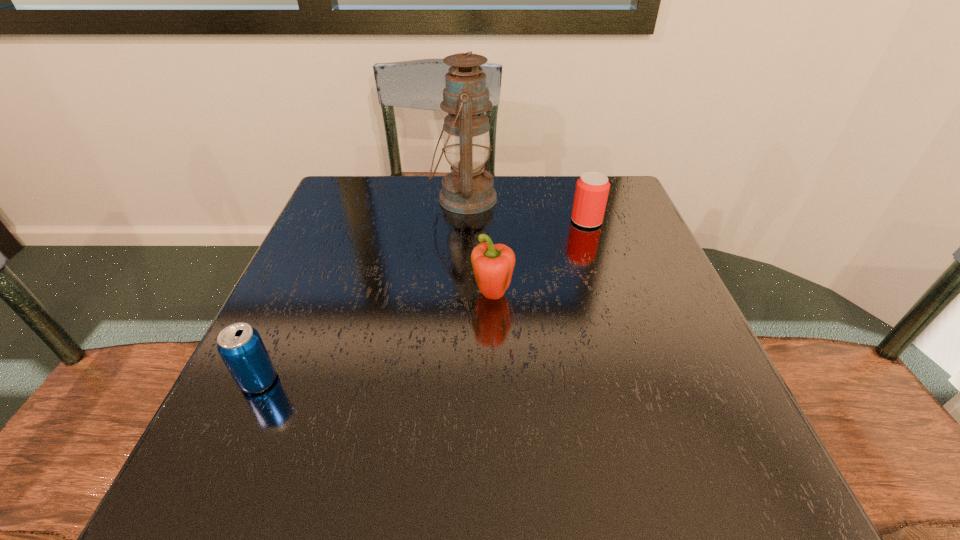
Locate an element on the screen. This screenshot has width=960, height=540. object that is the third nearest to the third farthest object is located at coordinates (240, 346).

Choose which object is the second nearest neighbor to the beer can. Please provide its 2D coordinates. Your answer should be formatted as a tuple, i.e. [(x, y)], where the tuple contains the x and y coordinates of a point satisfying the conditions above.

[(493, 265)]

The height and width of the screenshot is (540, 960). Identify the location of free location that satisfies the following two spatial constraints: 1. on the back side of the pop soda; 2. on the left side of the third farthest object. (297, 296).

Where is `vacant space that satisfies the following two spatial constraints: 1. on the back side of the tallest object; 2. on the left side of the pop soda`? Image resolution: width=960 pixels, height=540 pixels. vacant space that satisfies the following two spatial constraints: 1. on the back side of the tallest object; 2. on the left side of the pop soda is located at coordinates (341, 199).